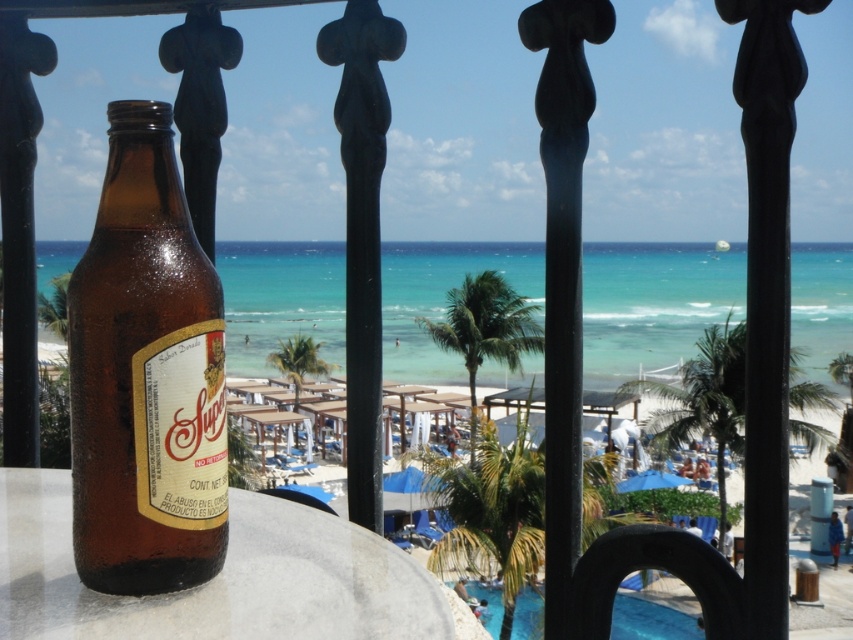
Question: Is smooth white table at center below blue glossy pool at lower center?

Choices:
 (A) yes
 (B) no

Answer: (B)

Question: In this image, where is smooth white table at center located relative to blue glossy pool at lower center?

Choices:
 (A) right
 (B) left

Answer: (B)

Question: Is brown glass bottle at left bigger than smooth white table at center?

Choices:
 (A) no
 (B) yes

Answer: (A)

Question: Which point appears closest to the camera in this image?

Choices:
 (A) (531, 596)
 (B) (286, 525)
 (C) (148, 365)

Answer: (C)

Question: Considering the real-world distances, which object is closest to the smooth white table at center?

Choices:
 (A) brown glass bottle at left
 (B) blue glossy pool at lower center

Answer: (A)

Question: Which of these objects is positioned farthest from the blue glossy pool at lower center?

Choices:
 (A) brown glass bottle at left
 (B) smooth white table at center

Answer: (A)